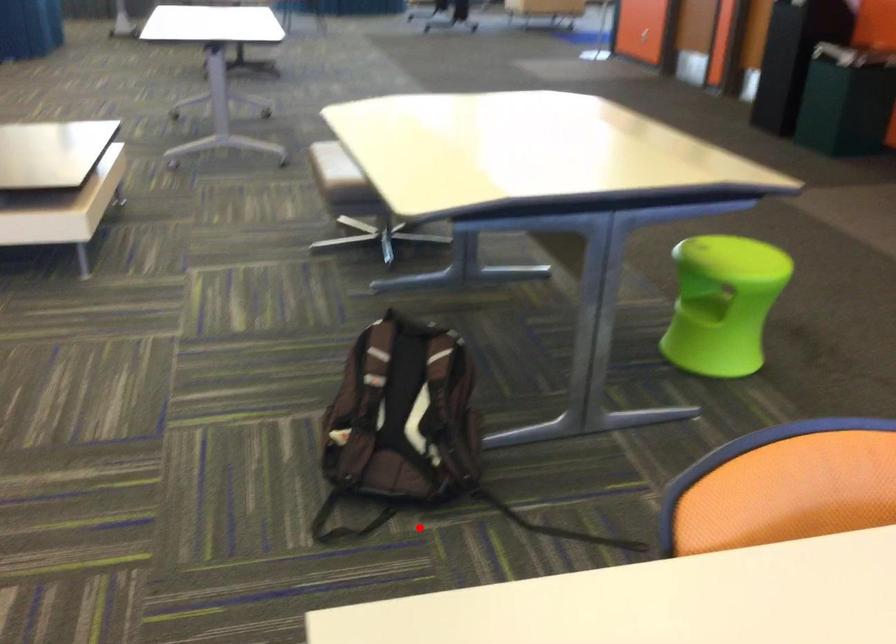
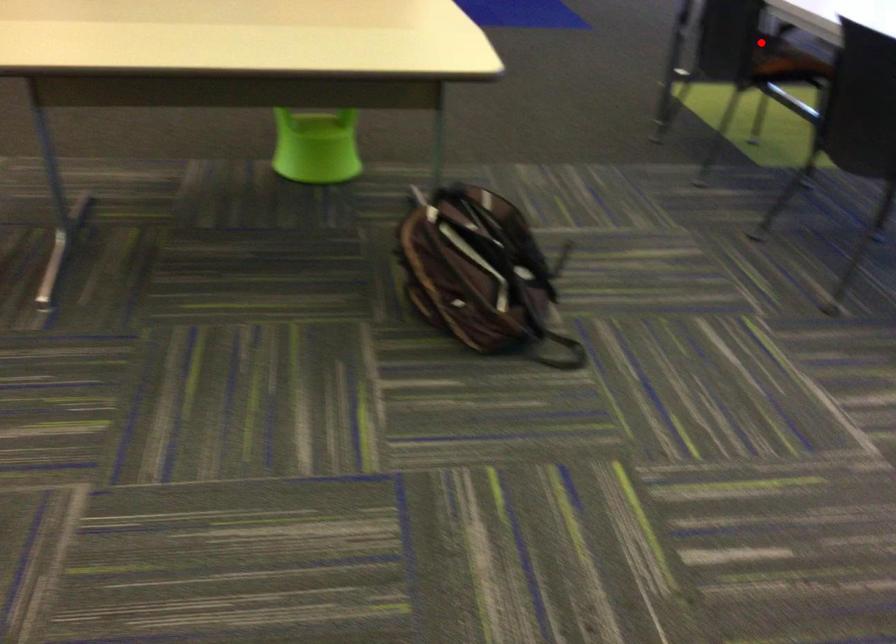
Based on the photo, I am providing you with two images of the same scene from different viewpoints. A red point is marked on the first image and another point is marked on the second image. Are the points marked in image1 and image2 representing the same 3D position?

No